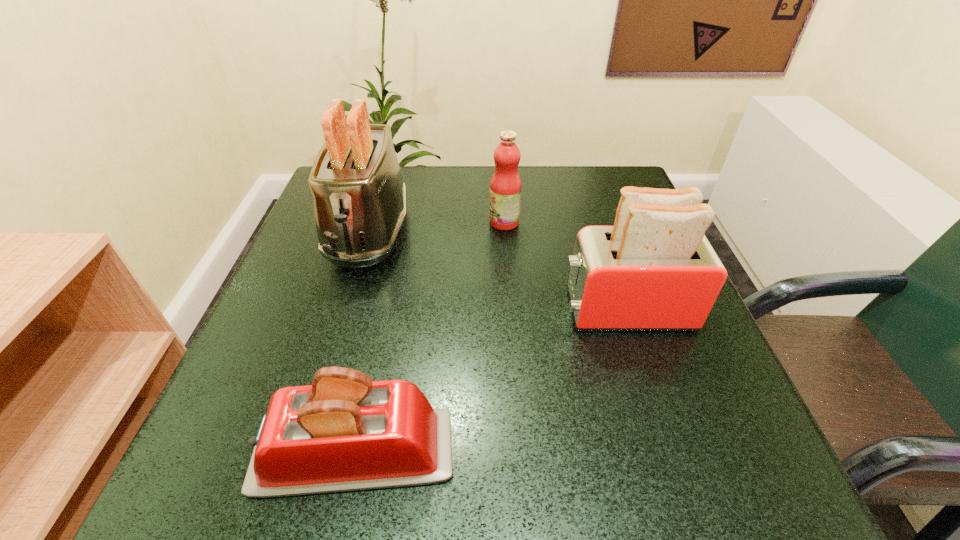
This screenshot has width=960, height=540. Find the location of `vacant space at the near edge of the desktop`. vacant space at the near edge of the desktop is located at coordinates (578, 448).

Locate an element on the screen. This screenshot has height=540, width=960. vacant space at the left edge of the desktop is located at coordinates (292, 327).

In the image, there is a desktop. At what (x,y) coordinates should I click in order to perform the action: click on vacant space at the right edge. Please return your answer as a coordinate pair (x, y). Looking at the image, I should click on (688, 346).

Where is `vacant space at the near left corner of the desktop`? The height and width of the screenshot is (540, 960). vacant space at the near left corner of the desktop is located at coordinates (198, 474).

In the image, there is a desktop. Where is `vacant space at the near right corner`? The height and width of the screenshot is (540, 960). vacant space at the near right corner is located at coordinates (661, 451).

Where is `unoccupied position between the rightmost object and the nearest object`? This screenshot has height=540, width=960. unoccupied position between the rightmost object and the nearest object is located at coordinates (490, 381).

Where is `vacant space that's between the shortest toaster and the farthest toaster`? The width and height of the screenshot is (960, 540). vacant space that's between the shortest toaster and the farthest toaster is located at coordinates (362, 342).

Where is `vacant space that is in between the third farthest object and the second object from right to left`? The height and width of the screenshot is (540, 960). vacant space that is in between the third farthest object and the second object from right to left is located at coordinates (564, 266).

I want to click on vacant area that lies between the nearest toaster and the second object from right to left, so click(429, 338).

Image resolution: width=960 pixels, height=540 pixels. Identify the location of vacant space that's between the fruit juice and the third farthest object. (564, 266).